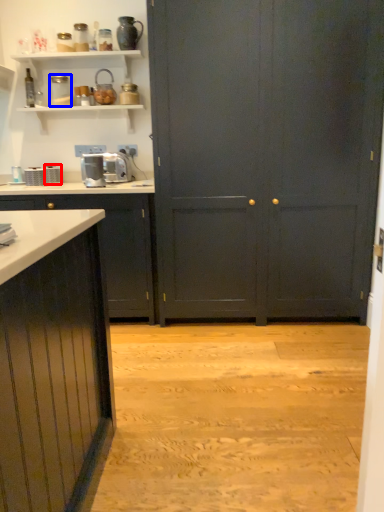
Question: Which point is further to the camera, appliance (highlighted by a red box) or appliance (highlighted by a blue box)?

Choices:
 (A) appliance
 (B) appliance

Answer: (A)